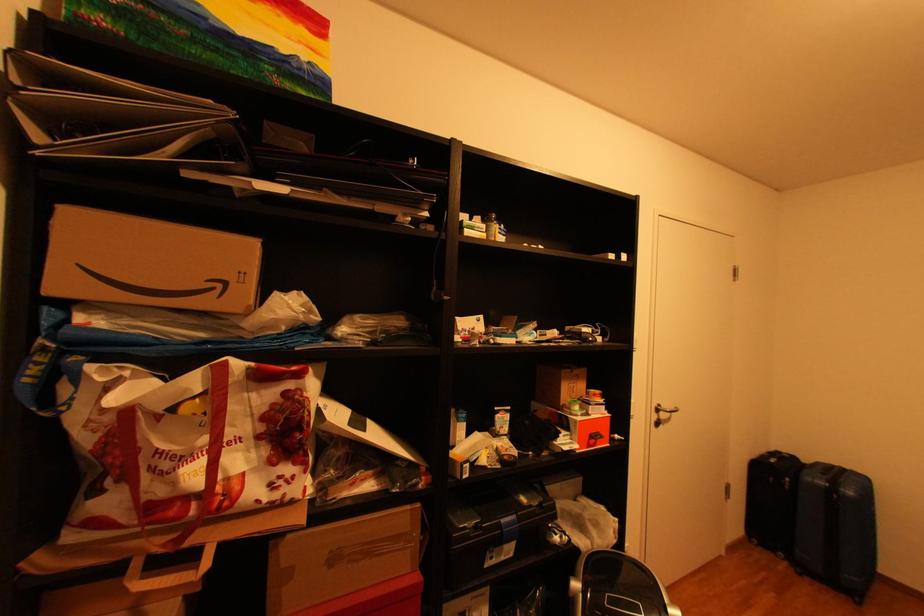
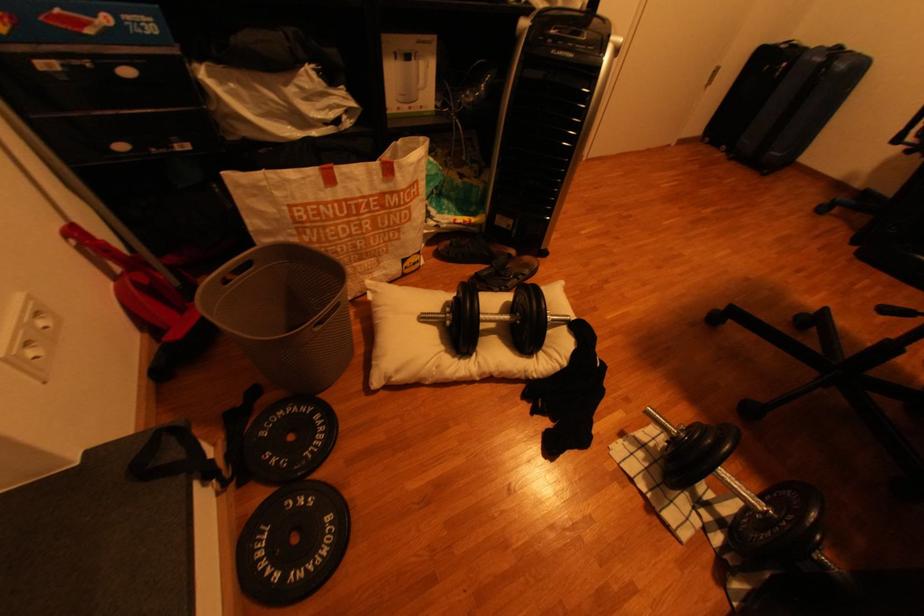
Question: The images are taken continuously from a first-person perspective. In which direction is your viewpoint rotating?

Choices:
 (A) Left
 (B) Right
 (C) Up
 (D) Down

Answer: (D)